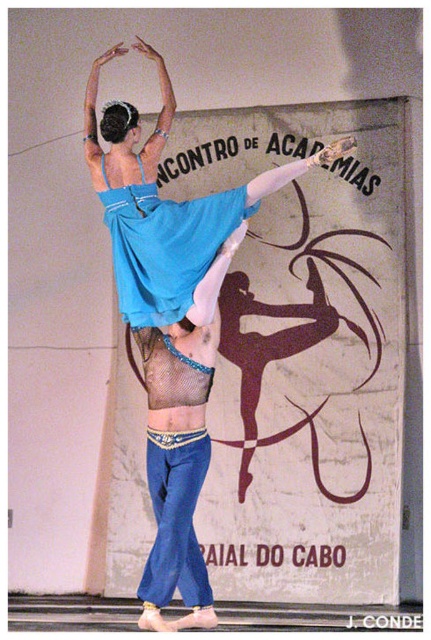
Question: Which point is closer to the camera taking this photo?

Choices:
 (A) (184, 264)
 (B) (183, 282)

Answer: (A)

Question: Does matte blue fabric dress at center have a lesser width compared to matte blue fabric at center?

Choices:
 (A) yes
 (B) no

Answer: (B)

Question: Among these objects, which one is nearest to the camera?

Choices:
 (A) matte blue fabric at center
 (B) matte blue fabric dress at center

Answer: (B)

Question: Which object appears farthest from the camera in this image?

Choices:
 (A) matte blue fabric dress at center
 (B) matte blue fabric at center

Answer: (B)

Question: Is matte blue fabric dress at center in front of matte blue fabric at center?

Choices:
 (A) no
 (B) yes

Answer: (B)

Question: Is matte blue fabric dress at center closer to camera compared to matte blue fabric at center?

Choices:
 (A) no
 (B) yes

Answer: (B)